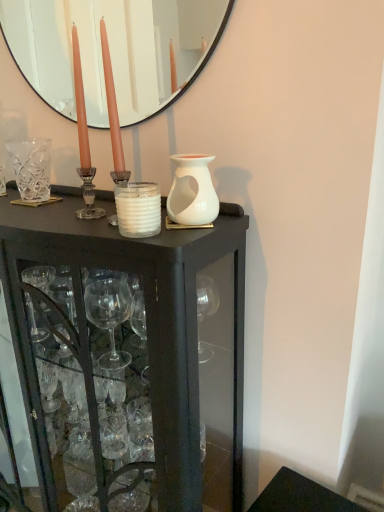
Question: Is white matte vase at center at the back of black glass cabinet at center?

Choices:
 (A) no
 (B) yes

Answer: (A)

Question: Would you say black glass cabinet at center is a long distance from white matte vase at center?

Choices:
 (A) yes
 (B) no

Answer: (B)

Question: Is black glass cabinet at center at the left side of white matte vase at center?

Choices:
 (A) no
 (B) yes

Answer: (B)

Question: Is black glass cabinet at center not within white matte vase at center?

Choices:
 (A) no
 (B) yes

Answer: (B)

Question: From a real-world perspective, is black glass cabinet at center physically above white matte vase at center?

Choices:
 (A) yes
 (B) no

Answer: (B)

Question: From the image's perspective, is white matte vase at center above or below matte black mirror at upper center?

Choices:
 (A) above
 (B) below

Answer: (B)

Question: Looking at their shapes, would you say white matte vase at center is wider or thinner than matte black mirror at upper center?

Choices:
 (A) thin
 (B) wide

Answer: (B)

Question: From a real-world perspective, is white matte vase at center positioned above or below matte black mirror at upper center?

Choices:
 (A) above
 (B) below

Answer: (B)

Question: Choose the correct answer: Is white matte vase at center inside matte black mirror at upper center or outside it?

Choices:
 (A) inside
 (B) outside

Answer: (B)

Question: Considering the relative positions of white matte candle at center and black glass cabinet at center in the image provided, is white matte candle at center to the left or to the right of black glass cabinet at center?

Choices:
 (A) right
 (B) left

Answer: (A)

Question: From a real-world perspective, is white matte candle at center physically located above or below black glass cabinet at center?

Choices:
 (A) below
 (B) above

Answer: (B)

Question: Do you think white matte candle at center is within black glass cabinet at center, or outside of it?

Choices:
 (A) inside
 (B) outside

Answer: (A)

Question: In terms of height, does white matte candle at center look taller or shorter compared to black glass cabinet at center?

Choices:
 (A) tall
 (B) short

Answer: (B)

Question: Visually, is white matte vase at center positioned to the left or to the right of white matte candle at center?

Choices:
 (A) left
 (B) right

Answer: (B)

Question: Is point [x=177, y=187] positioned closer to the camera than point [x=140, y=205]?

Choices:
 (A) closer
 (B) farther

Answer: (B)